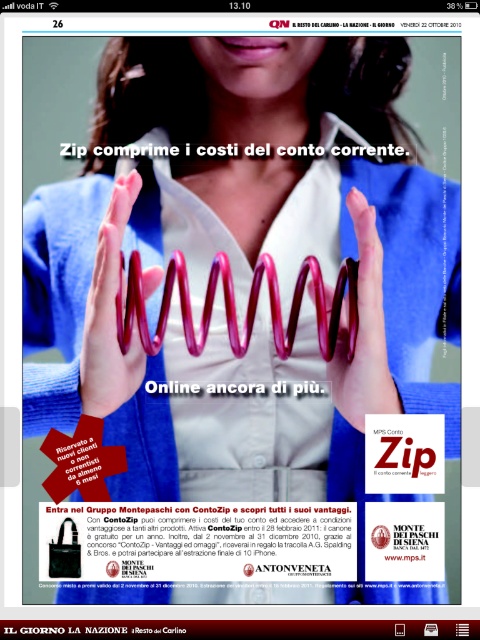
Does matte white shirt at center have a smaller size compared to white matte text at center?

No.

Is matte white shirt at center positioned before white matte text at center?

That is True.

Who is more distant from viewer, (x=173, y=336) or (x=181, y=387)?

The point (x=181, y=387) is more distant.

Locate an element on the screen. matte white shirt at center is located at coordinates (242, 264).

Between matte red spiral spring at center and white matte text at center, which one has more height?

Standing taller between the two is matte red spiral spring at center.

Can you confirm if matte red spiral spring at center is bigger than white matte text at center?

Indeed, matte red spiral spring at center has a larger size compared to white matte text at center.

What do you see at coordinates (363, 332) in the screenshot?
I see `matte red spiral spring at center` at bounding box center [363, 332].

At what (x,y) coordinates should I click in order to perform the action: click on matte red spiral spring at center. Please return your answer as a coordinate pair (x, y). This screenshot has height=640, width=480. Looking at the image, I should click on (363, 332).

Does point (159, 280) come behind point (154, 381)?

No, (159, 280) is in front of (154, 381).

Describe the element at coordinates (109, 314) in the screenshot. I see `matte pink spiral at center` at that location.

Image resolution: width=480 pixels, height=640 pixels. In order to click on matte pink spiral at center in this screenshot , I will do `click(109, 314)`.